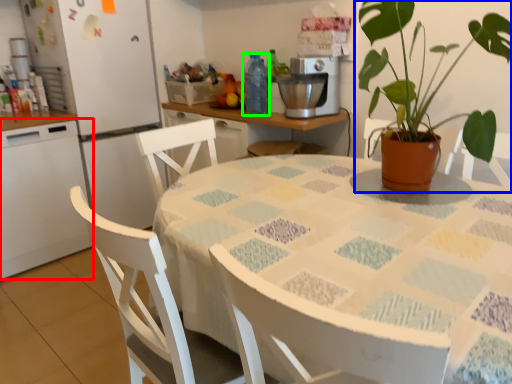
Question: Considering the real-world distances, which object is closest to kitchen appliance (highlighted by a red box)? houseplant (highlighted by a blue box) or bottle (highlighted by a green box).

Choices:
 (A) houseplant
 (B) bottle

Answer: (B)